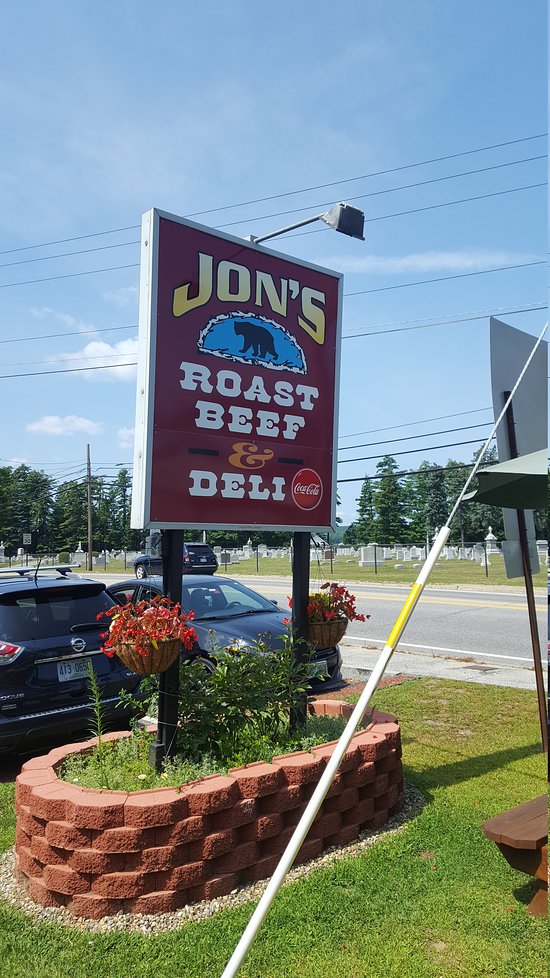
At what (x,y) coordinates should I click in order to perform the action: click on lamp. Please return your answer as a coordinate pair (x, y). Image resolution: width=550 pixels, height=978 pixels. Looking at the image, I should click on (349, 220).